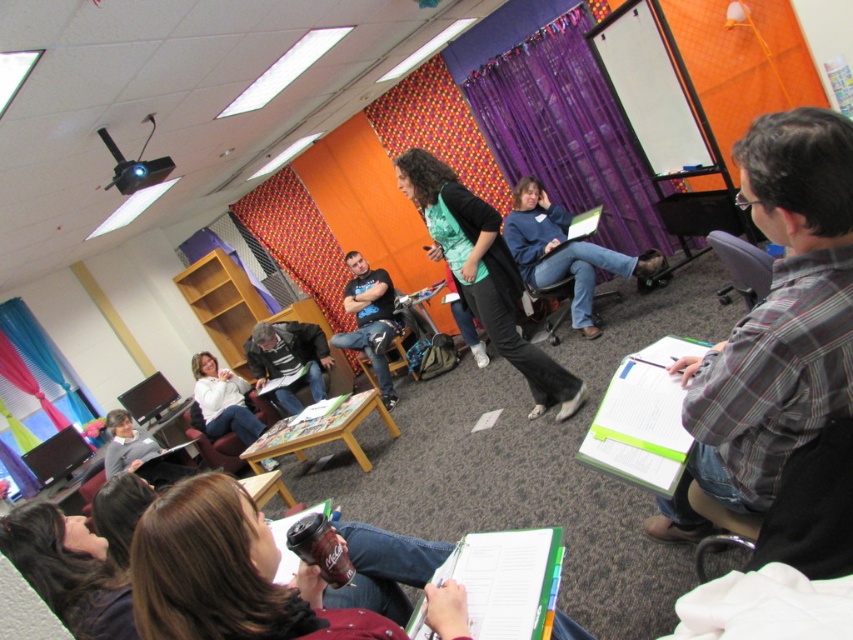
Question: Can you confirm if dark blue t-shirt at center is positioned above brown leather chair at lower left?

Choices:
 (A) no
 (B) yes

Answer: (B)

Question: Is plaid fabric shirt at right positioned at the back of dark gray sweater at center?

Choices:
 (A) no
 (B) yes

Answer: (A)

Question: Which object is the farthest from the blue fleece sweater at center?

Choices:
 (A) dark gray sweater at center
 (B) metallic gray chair at lower right
 (C) brown leather chair at center
 (D) white matte sweater at center

Answer: (B)

Question: Which object is positioned farthest from the dark blue t-shirt at center?

Choices:
 (A) teal fabric shirt at center
 (B) brown leather chair at center
 (C) dark gray sweater at center

Answer: (A)

Question: Which point is farther to the camera?

Choices:
 (A) (840, 486)
 (B) (531, 296)
 (C) (239, 436)
 (D) (367, 268)

Answer: (D)

Question: Considering the relative positions of plaid fabric shirt at right and blue fleece sweater at center in the image provided, where is plaid fabric shirt at right located with respect to blue fleece sweater at center?

Choices:
 (A) above
 (B) below

Answer: (B)